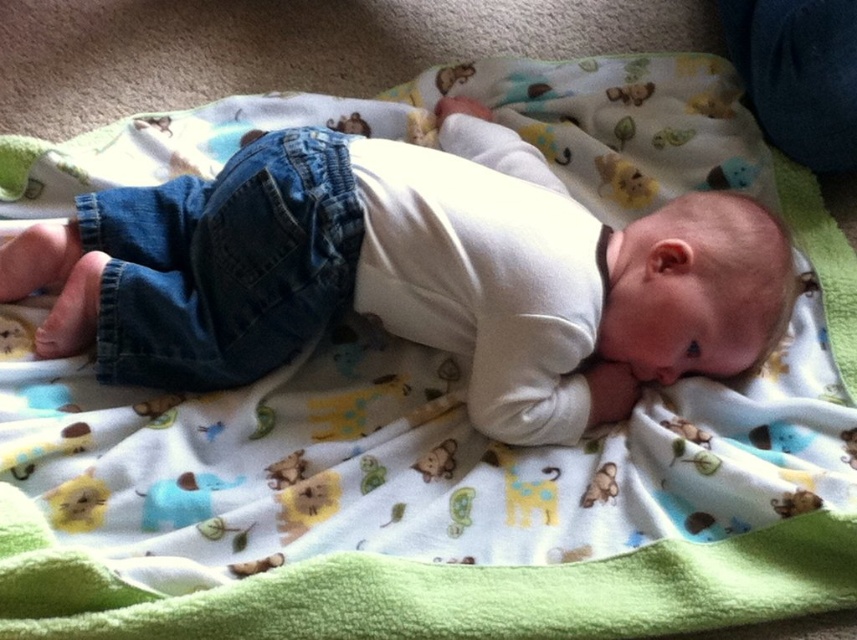
You are a photographer setting up a shoot for a baby product catalog. You need to ensure that the white soft baby at center is positioned higher than the denim pants at left in the final image. Based on the scene description, will this requirement be met?

The white soft baby at center is located above the denim pants at left, so the requirement is already met in the scene.